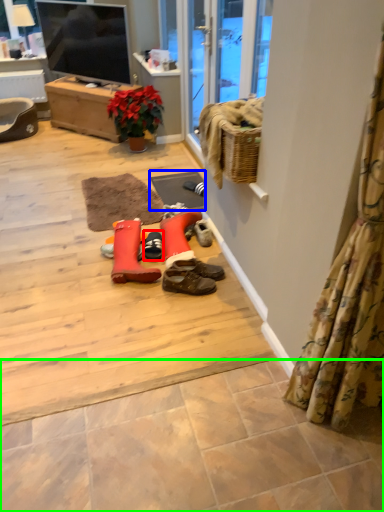
Question: Estimate the real-world distances between objects in this image. Which object is closer to footwear (highlighted by a red box), doormat (highlighted by a blue box) or tile (highlighted by a green box)?

Choices:
 (A) doormat
 (B) tile

Answer: (A)